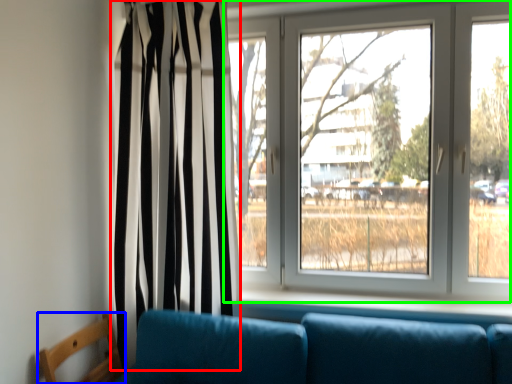
Question: Which object is positioned farthest from curtain (highlighted by a red box)? Select from furniture (highlighted by a blue box) and window (highlighted by a green box).

Choices:
 (A) furniture
 (B) window

Answer: (A)